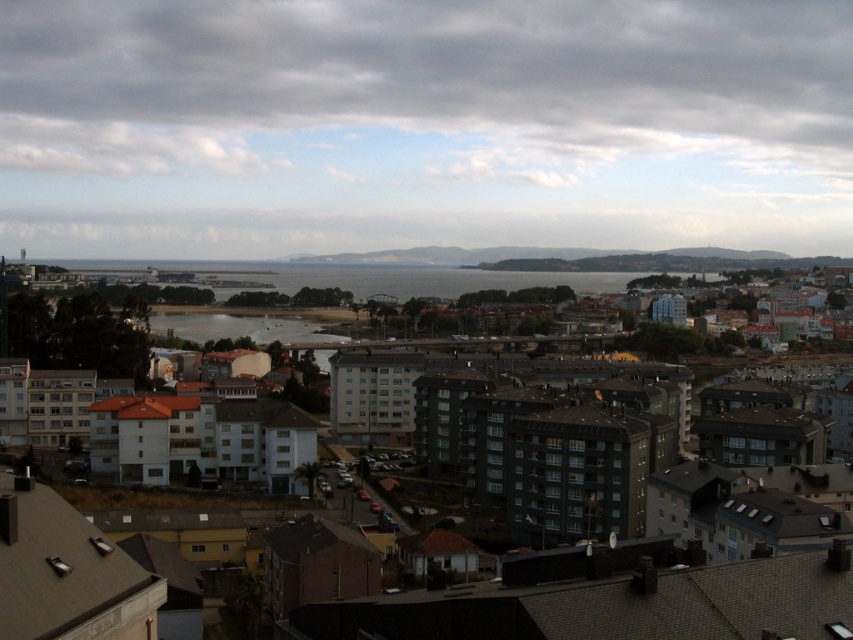
You are standing on a cliff overlooking the matte gray buildings at center in the coastal urban area. You want to throw a frisbee to a friend who is standing near the buildings. Considering the distance, can you estimate whether the throw is feasible with an average human arm strength?

The distance between you and the matte gray buildings at center is 54.95 meters. An average human can throw a frisbee about 30 to 40 meters, so the throw would likely be too far to reach your friend.

You are standing at the point closest to the camera in the image. Which of the two points, point (x=793, y=556) or point (x=189, y=320), is closer to you?

Point (x=793, y=556) is in front of point (x=189, y=320), so it is closer to you.

Based on the scene description, where exactly are the matte gray buildings at center located in terms of coordinates?

The matte gray buildings at center are located at point (x=610, y=600).